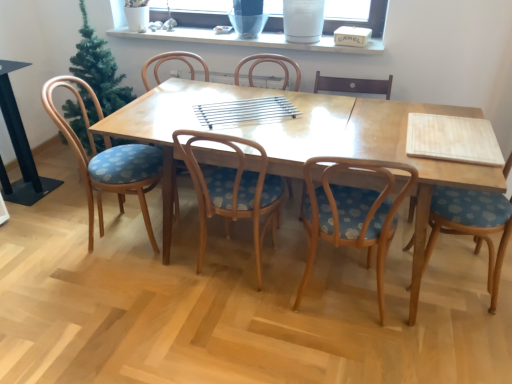
Where is `free space to the left of light brown wooden table at center`? free space to the left of light brown wooden table at center is located at coordinates (85, 273).